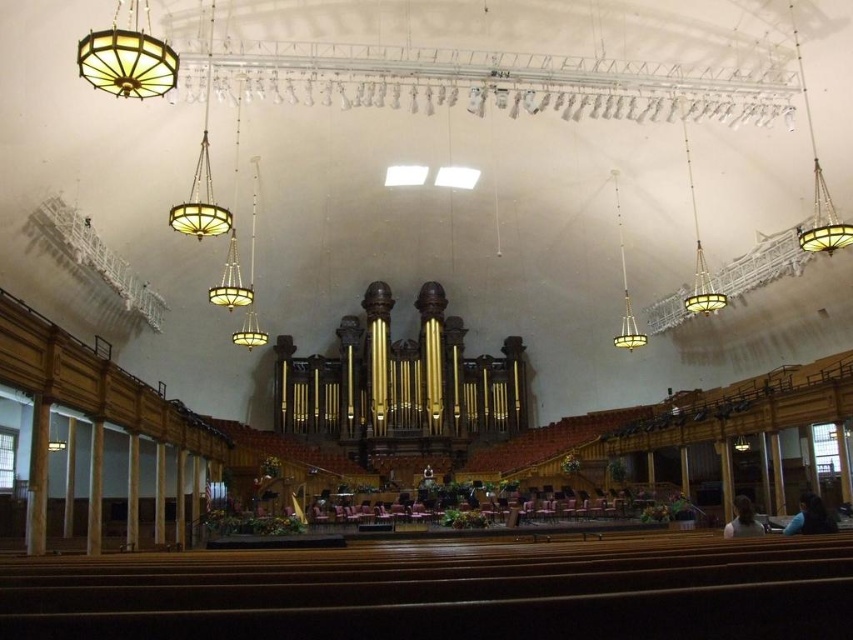
You are standing in the grand auditorium and want to move from the first point to the second point. Which direction should you move to get from point (701, 278) to point (622, 227)?

To move from point (701, 278) to point (622, 227), you should move backward since point (701, 278) is in front of point (622, 227).

You are an event planner setting up for a concert in the auditorium. You need to adjust the lighting to highlight the pipe organ. Which chandelier should you adjust first, the matte glass chandelier at upper center or the matte gold chandelier at upper center, to have a more immediate effect on the organ?

The matte glass chandelier at upper center is closer to the viewer than the matte gold chandelier at upper center, so adjusting the matte glass chandelier at upper center first would have a more immediate effect on the pipe organ.